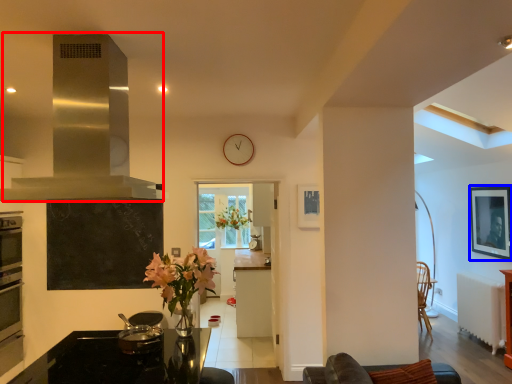
Question: Which point is closer to the camera, exhaust hood (highlighted by a red box) or picture frame (highlighted by a blue box)?

Choices:
 (A) exhaust hood
 (B) picture frame

Answer: (A)